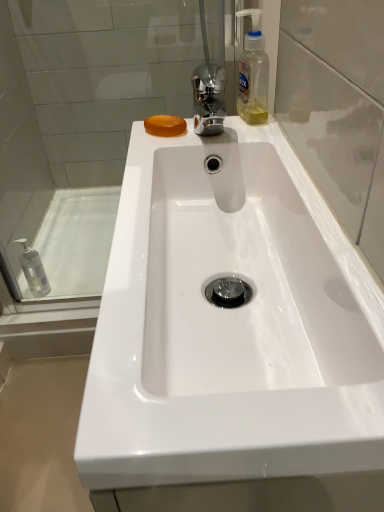
Question: Considering the relative sizes of transparent glass door at upper right and white glossy bath at left in the image provided, is transparent glass door at upper right thinner than white glossy bath at left?

Choices:
 (A) yes
 (B) no

Answer: (A)

Question: From the image's perspective, does transparent glass door at upper right appear higher than white glossy bath at left?

Choices:
 (A) yes
 (B) no

Answer: (A)

Question: From the image's perspective, is transparent glass door at upper right located beneath white glossy bath at left?

Choices:
 (A) no
 (B) yes

Answer: (A)

Question: Does transparent glass door at upper right touch white glossy bath at left?

Choices:
 (A) no
 (B) yes

Answer: (A)

Question: Considering the relative sizes of transparent glass door at upper right and white glossy bath at left in the image provided, is transparent glass door at upper right bigger than white glossy bath at left?

Choices:
 (A) yes
 (B) no

Answer: (B)

Question: Could you tell me if transparent glass door at upper right is facing white glossy bath at left?

Choices:
 (A) no
 (B) yes

Answer: (A)

Question: Considering the relative sizes of white glossy sink at center and white glossy bath at left in the image provided, is white glossy sink at center taller than white glossy bath at left?

Choices:
 (A) yes
 (B) no

Answer: (A)

Question: From a real-world perspective, is white glossy sink at center positioned under white glossy bath at left based on gravity?

Choices:
 (A) no
 (B) yes

Answer: (A)

Question: Is the position of white glossy sink at center more distant than that of white glossy bath at left?

Choices:
 (A) no
 (B) yes

Answer: (A)

Question: Is white glossy sink at center closer to camera compared to white glossy bath at left?

Choices:
 (A) no
 (B) yes

Answer: (B)

Question: From the image's perspective, does white glossy sink at center appear higher than white glossy bath at left?

Choices:
 (A) yes
 (B) no

Answer: (B)

Question: Is white glossy bath at left inside white glossy sink at center?

Choices:
 (A) yes
 (B) no

Answer: (B)

Question: Does transparent glass door at upper right have a larger size compared to transparent glass shower door at upper left?

Choices:
 (A) no
 (B) yes

Answer: (A)